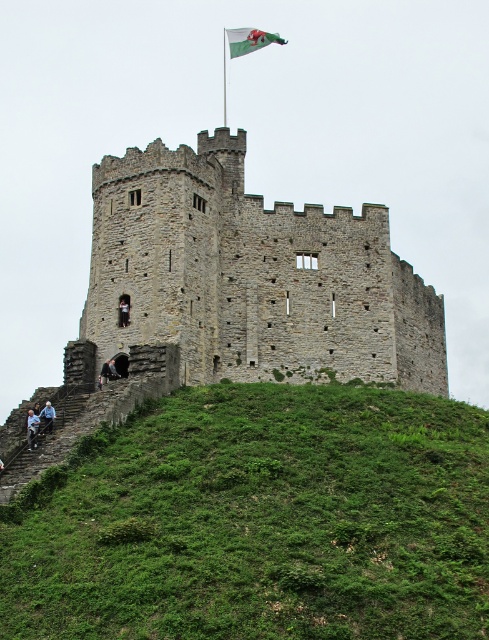
Which of these two, green grassy hillside at lower left or light blue denim jacket at lower left, stands shorter?

light blue denim jacket at lower left is shorter.

Can you confirm if green grassy hillside at lower left is positioned to the left of light blue denim jacket at lower left?

No, green grassy hillside at lower left is not to the left of light blue denim jacket at lower left.

Is point (117, 476) in front of point (48, 408)?

Yes.

Locate an element on the screen. green grassy hillside at lower left is located at coordinates (261, 522).

Is dark gray stone person at lower left wider than light blue denim jacket at lower left?

Yes.

Does point (35, 442) come in front of point (46, 404)?

Yes, point (35, 442) is in front of point (46, 404).

Locate an element on the screen. The image size is (489, 640). dark gray stone person at lower left is located at coordinates (31, 428).

Between green fabric flag at upper center and light blue denim jacket at lower left, which one is positioned higher?

Positioned higher is green fabric flag at upper center.

Which of these two, green fabric flag at upper center or light blue denim jacket at lower left, stands shorter?

Standing shorter between the two is light blue denim jacket at lower left.

Is point (263, 44) more distant than point (48, 401)?

That is True.

Find the location of `green fabric flag at upper center`. green fabric flag at upper center is located at coordinates (249, 38).